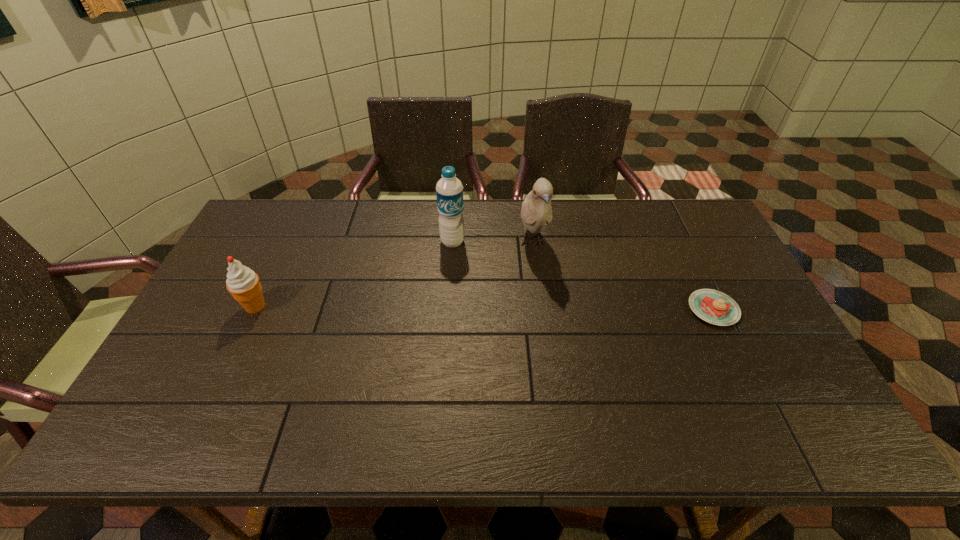
Where is `free spot between the third object from right to left and the third object from left to right`? Image resolution: width=960 pixels, height=540 pixels. free spot between the third object from right to left and the third object from left to right is located at coordinates (492, 242).

The image size is (960, 540). Find the location of `vacant space in between the third object from left to right and the rightmost object`. vacant space in between the third object from left to right and the rightmost object is located at coordinates (623, 276).

Locate an element on the screen. This screenshot has width=960, height=540. empty space between the bird and the pastry is located at coordinates (623, 276).

Locate an element on the screen. vacant space that's between the water bottle and the pastry is located at coordinates (583, 275).

Locate which object is the third closest to the leftmost object. Please provide its 2D coordinates. Your answer should be formatted as a tuple, i.e. [(x, y)], where the tuple contains the x and y coordinates of a point satisfying the conditions above.

[(712, 306)]

Identify which object is the second nearest to the rightmost object. Please provide its 2D coordinates. Your answer should be formatted as a tuple, i.e. [(x, y)], where the tuple contains the x and y coordinates of a point satisfying the conditions above.

[(449, 190)]

Locate an element on the screen. The image size is (960, 540). free space that satisfies the following two spatial constraints: 1. on the back side of the second object from right to left; 2. on the right side of the second shortest object is located at coordinates (286, 243).

I want to click on vacant position in the image that satisfies the following two spatial constraints: 1. on the front side of the rightmost object; 2. on the left side of the third tallest object, so click(254, 309).

This screenshot has width=960, height=540. I want to click on free location that satisfies the following two spatial constraints: 1. on the back side of the third object from left to right; 2. on the right side of the second shortest object, so click(x=286, y=243).

Identify the location of vacant position in the image that satisfies the following two spatial constraints: 1. on the front side of the water bottle; 2. on the left side of the second object from right to left. The image size is (960, 540). (452, 243).